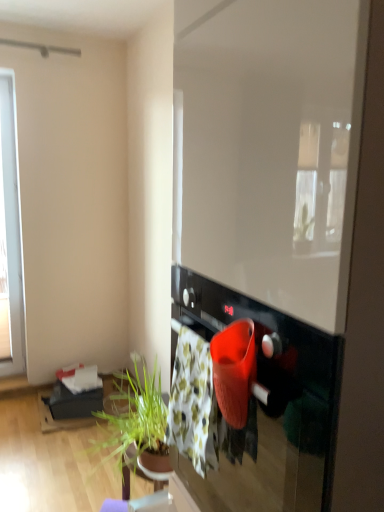
Question: From a real-world perspective, is black glossy oven at center below transparent glass window screen at center?

Choices:
 (A) no
 (B) yes

Answer: (B)

Question: Can you confirm if black glossy oven at center is bigger than transparent glass window screen at center?

Choices:
 (A) yes
 (B) no

Answer: (B)

Question: From the image's perspective, is black glossy oven at center located beneath transparent glass window screen at center?

Choices:
 (A) yes
 (B) no

Answer: (A)

Question: Does black glossy oven at center contain transparent glass window screen at center?

Choices:
 (A) no
 (B) yes

Answer: (A)

Question: From a real-world perspective, is black glossy oven at center on transparent glass window screen at center?

Choices:
 (A) yes
 (B) no

Answer: (B)

Question: Would you consider black glossy oven at center to be distant from transparent glass window screen at center?

Choices:
 (A) yes
 (B) no

Answer: (B)

Question: Can you confirm if black glossy oven at center is thinner than floral cotton blanket at center?

Choices:
 (A) no
 (B) yes

Answer: (A)

Question: Is black glossy oven at center outside floral cotton blanket at center?

Choices:
 (A) yes
 (B) no

Answer: (A)

Question: Is the depth of black glossy oven at center less than that of floral cotton blanket at center?

Choices:
 (A) no
 (B) yes

Answer: (B)

Question: From the image's perspective, is black glossy oven at center beneath floral cotton blanket at center?

Choices:
 (A) no
 (B) yes

Answer: (B)

Question: Is black glossy oven at center directly adjacent to floral cotton blanket at center?

Choices:
 (A) yes
 (B) no

Answer: (B)

Question: Does black glossy oven at center appear on the left side of floral cotton blanket at center?

Choices:
 (A) yes
 (B) no

Answer: (B)

Question: Considering the relative sizes of transparent glass window screen at center and floral cotton blanket at center in the image provided, is transparent glass window screen at center taller than floral cotton blanket at center?

Choices:
 (A) yes
 (B) no

Answer: (A)